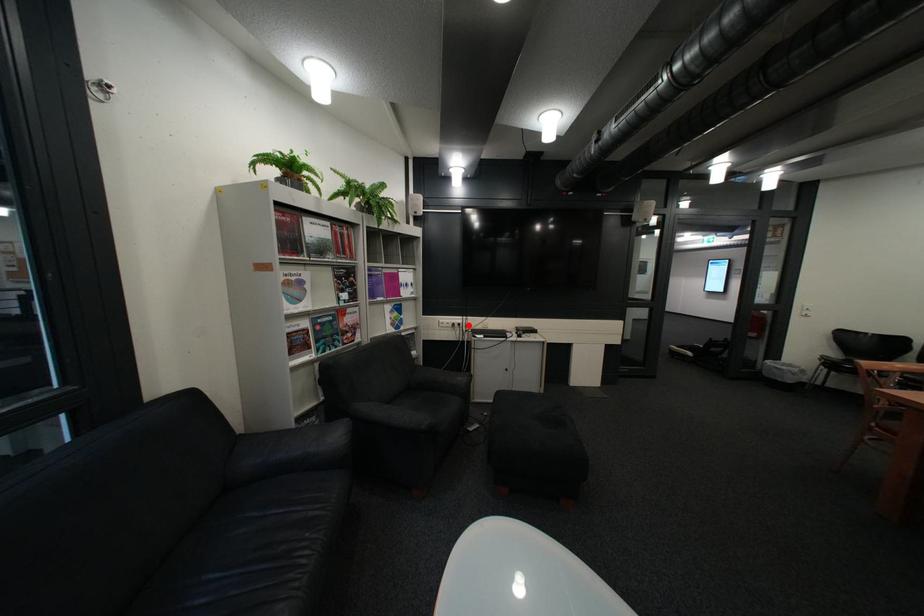
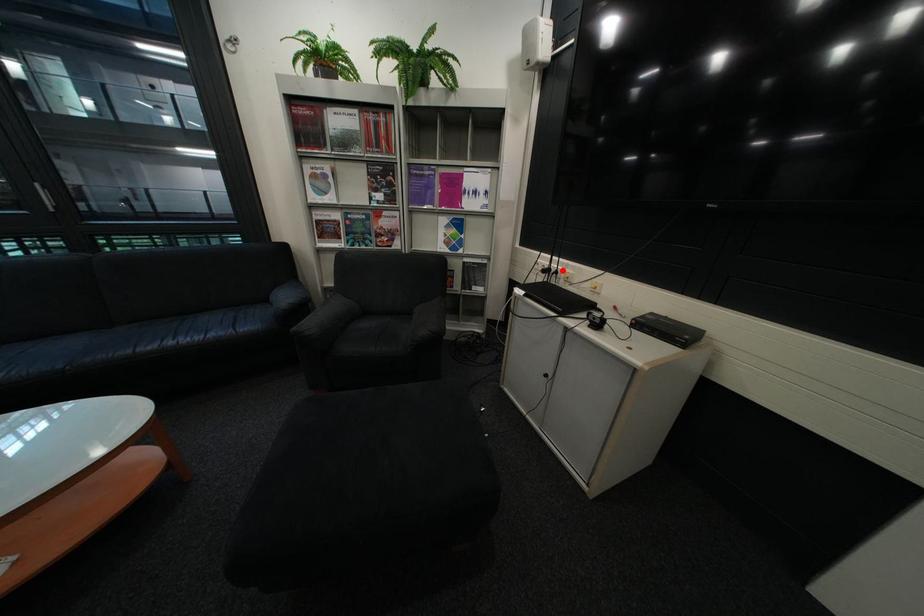
I am providing you with two images of the same scene from different viewpoints. A red point is marked on the first image and another point is marked on the second image. Is the red point in image1 aligned with the point shown in image2?

Yes